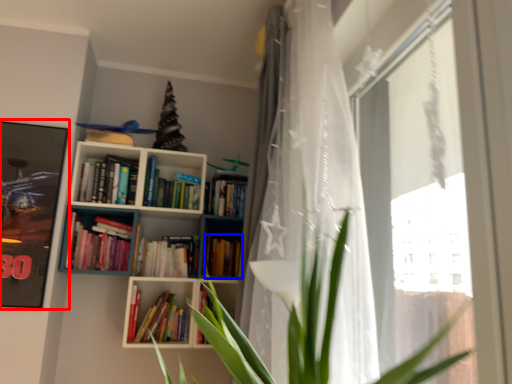
Question: Which point is further to the camera, picture frame (highlighted by a red box) or book (highlighted by a blue box)?

Choices:
 (A) picture frame
 (B) book

Answer: (B)